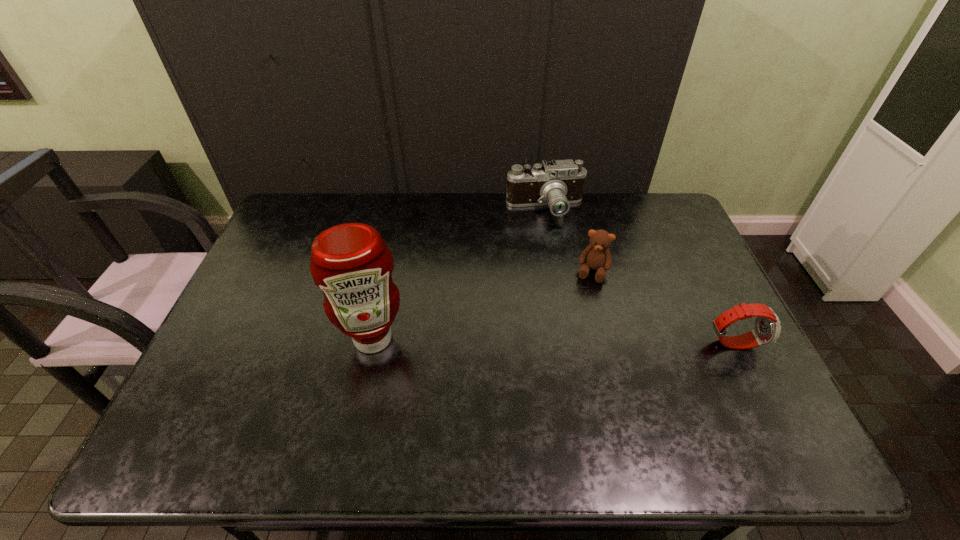
The width and height of the screenshot is (960, 540). In order to click on free spot on the desktop that is between the tallest object and the watch and is positioned on the face of the third nearest object in this screenshot , I will do `click(574, 341)`.

Where is `free space on the desktop that is between the condiment and the watch and is positioned at the lens of the farthest object`? free space on the desktop that is between the condiment and the watch and is positioned at the lens of the farthest object is located at coordinates (562, 341).